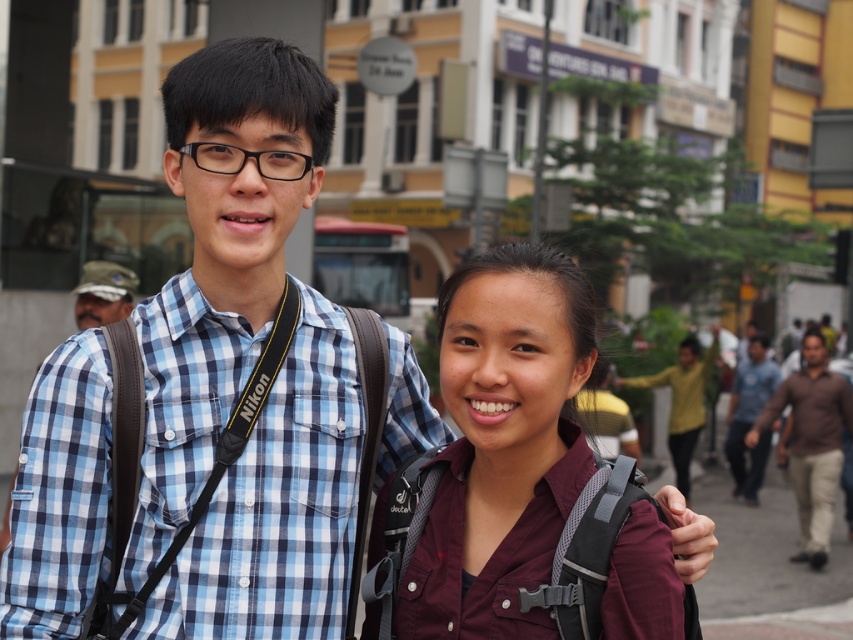
Question: Does maroon fabric shirt at lower right have a lesser width compared to camouflage fabric hat at left?

Choices:
 (A) no
 (B) yes

Answer: (A)

Question: Among these objects, which one is farthest from the camera?

Choices:
 (A) maroon fabric shirt at lower right
 (B) brown cotton shirt at right
 (C) camouflage fabric hat at left
 (D) dark blue jeans at right

Answer: (D)

Question: Can you confirm if blue checkered shirt at center is smaller than yellow matte shirt at center?

Choices:
 (A) yes
 (B) no

Answer: (A)

Question: Which of the following is the closest to the observer?

Choices:
 (A) camouflage fabric hat at left
 (B) blue checkered shirt at center

Answer: (B)

Question: Is yellow matte shirt at center positioned at the back of camouflage fabric hat at left?

Choices:
 (A) yes
 (B) no

Answer: (A)

Question: Which point appears closest to the camera in this image?

Choices:
 (A) (689, 358)
 (B) (270, 131)
 (C) (828, 401)

Answer: (B)